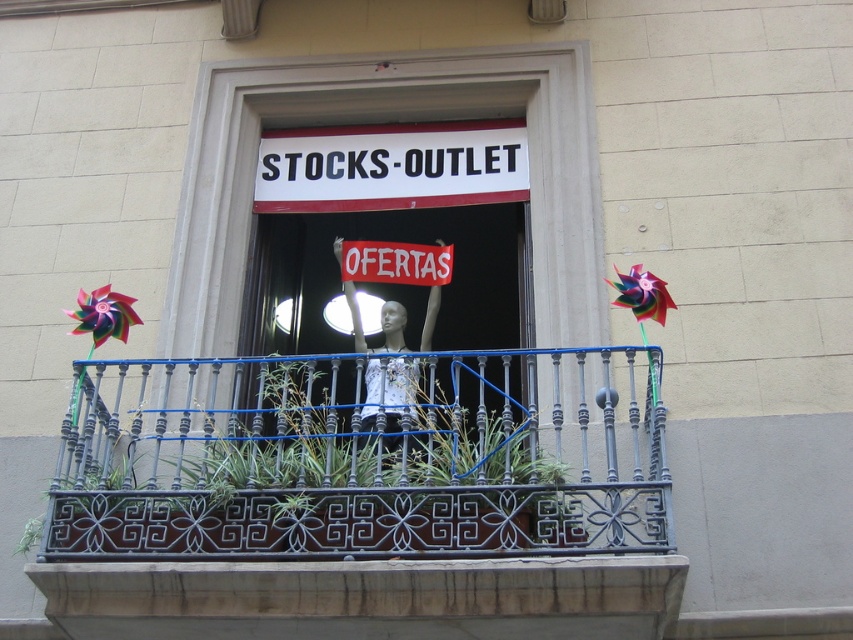
In the scene shown: Does dark gray wrought iron at center appear on the left side of white plastic sign at center?

Indeed, dark gray wrought iron at center is positioned on the left side of white plastic sign at center.

Can you confirm if dark gray wrought iron at center is positioned to the right of white plastic sign at center?

No, dark gray wrought iron at center is not to the right of white plastic sign at center.

Where is `dark gray wrought iron at center`? dark gray wrought iron at center is located at coordinates (361, 458).

Which is more to the left, white plastic sign at center or red fabric sign at center?

Positioned to the left is red fabric sign at center.

The height and width of the screenshot is (640, 853). Identify the location of white plastic sign at center. click(392, 166).

Locate an element on the screen. The image size is (853, 640). white plastic sign at center is located at coordinates (392, 166).

The image size is (853, 640). Find the location of `white plastic sign at center`. white plastic sign at center is located at coordinates (392, 166).